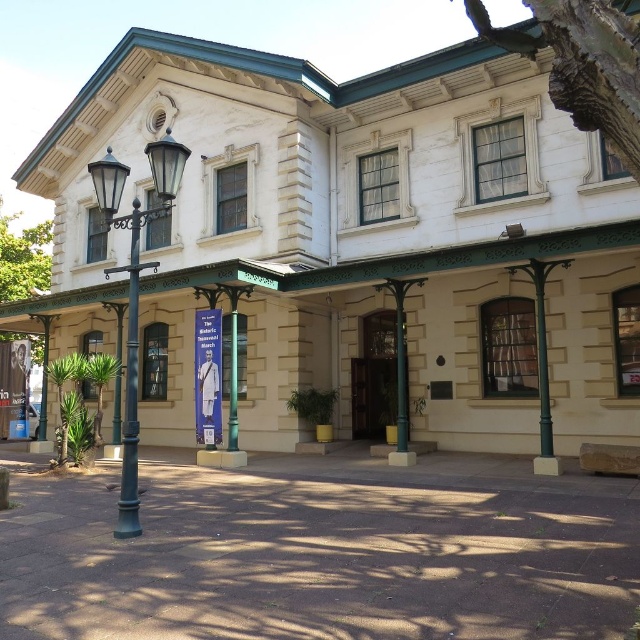
Based on the coordinates provided in the description, where is the beige stone building at center located?

The beige stone building at center is located at point coordinates of [356,241].